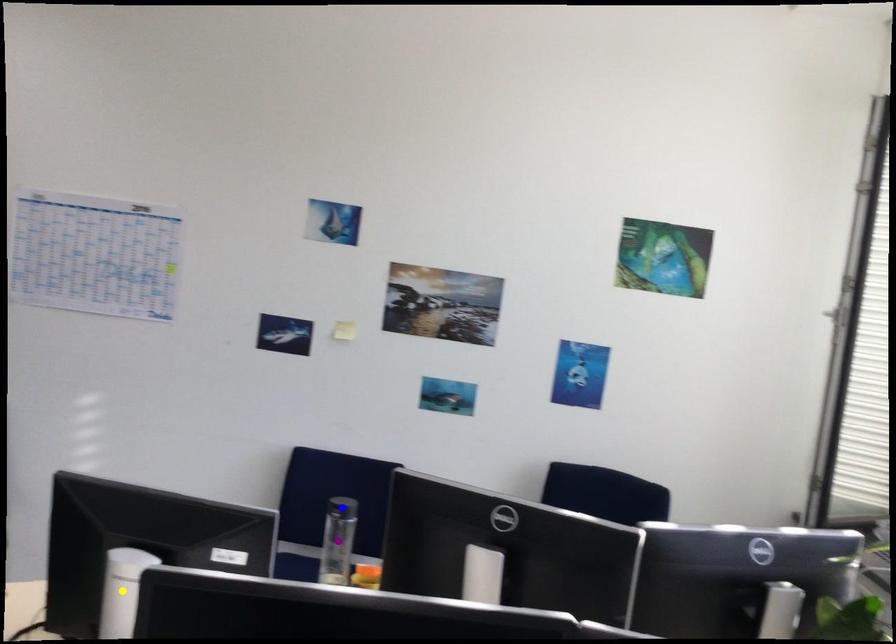
Order these from nearest to farthest:
purple point, yellow point, blue point

yellow point → purple point → blue point